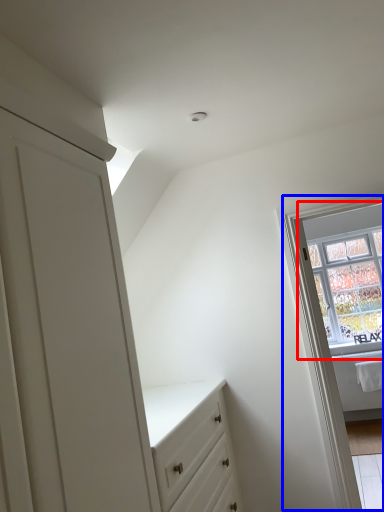
Question: Which object appears farthest to the camera in this image, window (highlighted by a red box) or window frame (highlighted by a blue box)?

Choices:
 (A) window
 (B) window frame

Answer: (A)